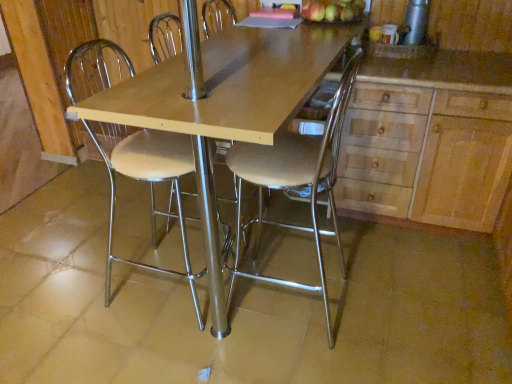
Question: Can you confirm if metallic silver chair at center, which is the 1th chair from right to left, is shorter than silver metallic thermos at upper right?

Choices:
 (A) yes
 (B) no

Answer: (B)

Question: Considering the relative sizes of metallic silver chair at center, which is the 2th chair in left-to-right order, and silver metallic thermos at upper right in the image provided, is metallic silver chair at center, which is the 2th chair in left-to-right order, smaller than silver metallic thermos at upper right?

Choices:
 (A) yes
 (B) no

Answer: (B)

Question: Is metallic silver chair at center, which is the 2th chair in left-to-right order, beside silver metallic thermos at upper right?

Choices:
 (A) no
 (B) yes

Answer: (A)

Question: Does metallic silver chair at center, which is the 2th chair in left-to-right order, have a greater width compared to silver metallic thermos at upper right?

Choices:
 (A) no
 (B) yes

Answer: (B)

Question: Does metallic silver chair at center, which is the 2th chair in left-to-right order, have a larger size compared to silver metallic thermos at upper right?

Choices:
 (A) yes
 (B) no

Answer: (A)

Question: From a real-world perspective, is metallic silver chair at center, which is the 1th chair from right to left, located beneath silver metallic thermos at upper right?

Choices:
 (A) no
 (B) yes

Answer: (B)

Question: Considering the relative sizes of silver metallic thermos at upper right and wooden table at center in the image provided, is silver metallic thermos at upper right taller than wooden table at center?

Choices:
 (A) no
 (B) yes

Answer: (A)

Question: Is silver metallic thermos at upper right outside of wooden table at center?

Choices:
 (A) yes
 (B) no

Answer: (A)

Question: Is silver metallic thermos at upper right directly adjacent to wooden table at center?

Choices:
 (A) no
 (B) yes

Answer: (A)

Question: Considering the relative positions of silver metallic thermos at upper right and wooden table at center in the image provided, is silver metallic thermos at upper right behind wooden table at center?

Choices:
 (A) yes
 (B) no

Answer: (A)

Question: Does silver metallic thermos at upper right have a smaller size compared to wooden table at center?

Choices:
 (A) yes
 (B) no

Answer: (A)

Question: Is silver metallic thermos at upper right positioned far away from wooden table at center?

Choices:
 (A) no
 (B) yes

Answer: (A)

Question: From the image's perspective, is wooden table at center above wooden cabinet at right?

Choices:
 (A) yes
 (B) no

Answer: (B)